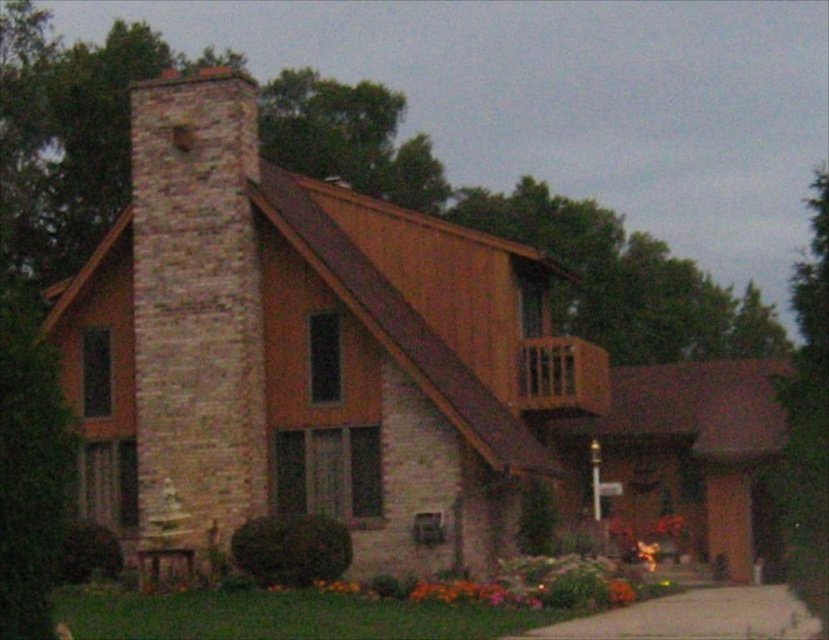
Question: Which point is farther to the camera?

Choices:
 (A) (291, 621)
 (B) (138, 236)

Answer: (B)

Question: Is brick chimney at left below green grass at lower center?

Choices:
 (A) no
 (B) yes

Answer: (A)

Question: Is brick chimney at left below green grass at lower center?

Choices:
 (A) yes
 (B) no

Answer: (B)

Question: Which of the following is the farthest from the observer?

Choices:
 (A) brick chimney at left
 (B) green grass at lower center

Answer: (A)

Question: Can you confirm if brick chimney at left is smaller than green grass at lower center?

Choices:
 (A) no
 (B) yes

Answer: (A)